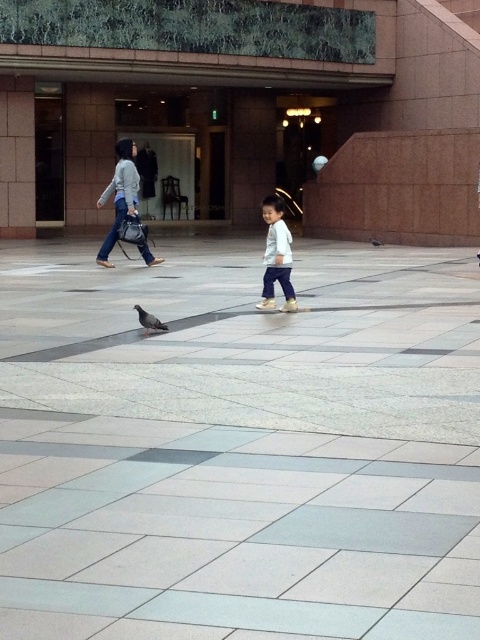
Question: Does matte gray sweater at upper left appear on the left side of light gray fleece jacket at center?

Choices:
 (A) no
 (B) yes

Answer: (B)

Question: Estimate the real-world distances between objects in this image. Which object is closer to the brown marble mall at center?

Choices:
 (A) light gray fleece jacket at center
 (B) matte gray sweater at upper left
 (C) gray matte pigeon at lower left
 (D) gray matte pigeon at center

Answer: (B)

Question: Which object is farther from the camera taking this photo?

Choices:
 (A) brown marble mall at center
 (B) matte gray sweater at upper left
 (C) gray matte pigeon at lower left

Answer: (A)

Question: Can you confirm if brown marble mall at center is thinner than light gray fleece jacket at center?

Choices:
 (A) yes
 (B) no

Answer: (B)

Question: Does matte gray sweater at upper left appear under gray matte pigeon at center?

Choices:
 (A) no
 (B) yes

Answer: (A)

Question: Which object is farther from the camera taking this photo?

Choices:
 (A) light gray fleece jacket at center
 (B) matte gray sweater at upper left
 (C) brown marble mall at center
 (D) gray matte pigeon at lower left

Answer: (C)